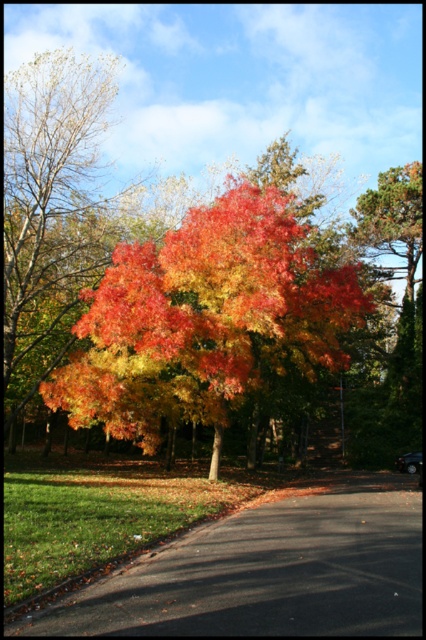
You are a painter standing at the edge of the black asphalt road at lower center, looking towards the vivid autumn leaves at center. Which object appears wider from your perspective?

The vivid autumn leaves at center appears wider than the black asphalt road at lower center because its width is larger according to the description.

You are a landscape architect designing a new park and want to ensure the black asphalt road at lower center is visible from the vivid autumn leaves at center. Considering their heights, which object would block the view of the other?

The vivid autumn leaves at center has a greater height compared to the black asphalt road at lower center, so the vivid autumn leaves at center would block the view of the black asphalt road at lower center.